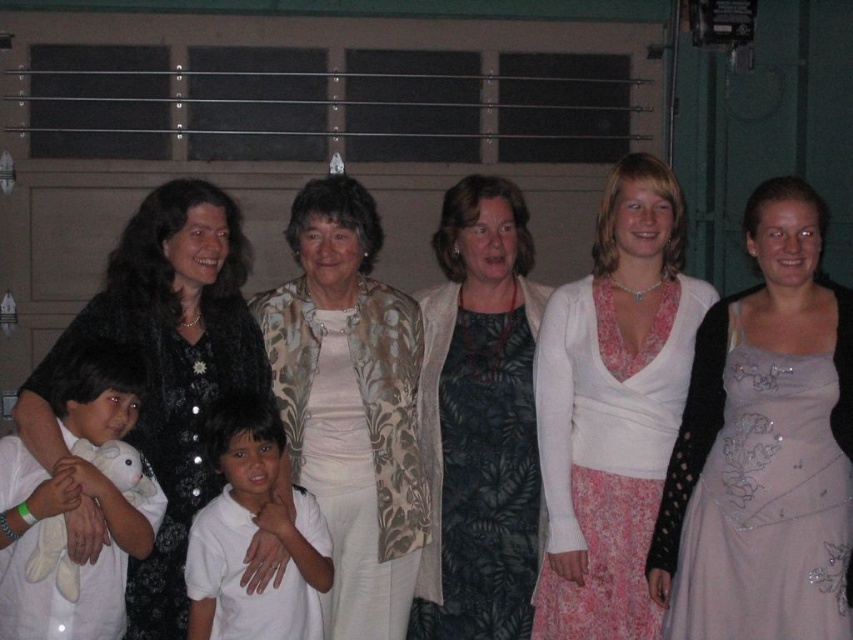
Question: Which of the following is the closest to the observer?

Choices:
 (A) (590, 342)
 (B) (842, 493)

Answer: (B)

Question: Which point is farther to the camera?

Choices:
 (A) white smooth shirt at center
 (B) white soft plush toy at left
 (C) black satin dress at left

Answer: (A)

Question: Can you confirm if black satin dress at left is positioned below white smooth shirt at center?

Choices:
 (A) yes
 (B) no

Answer: (B)

Question: Can you confirm if white textured top at center is wider than dark green dress at center?

Choices:
 (A) yes
 (B) no

Answer: (A)

Question: Is floral-patterned jacket at center bigger than dark green dress at center?

Choices:
 (A) yes
 (B) no

Answer: (A)

Question: Which object is the farthest from the white smooth shirt at center?

Choices:
 (A) white soft plush toy at left
 (B) dark green dress at center

Answer: (B)